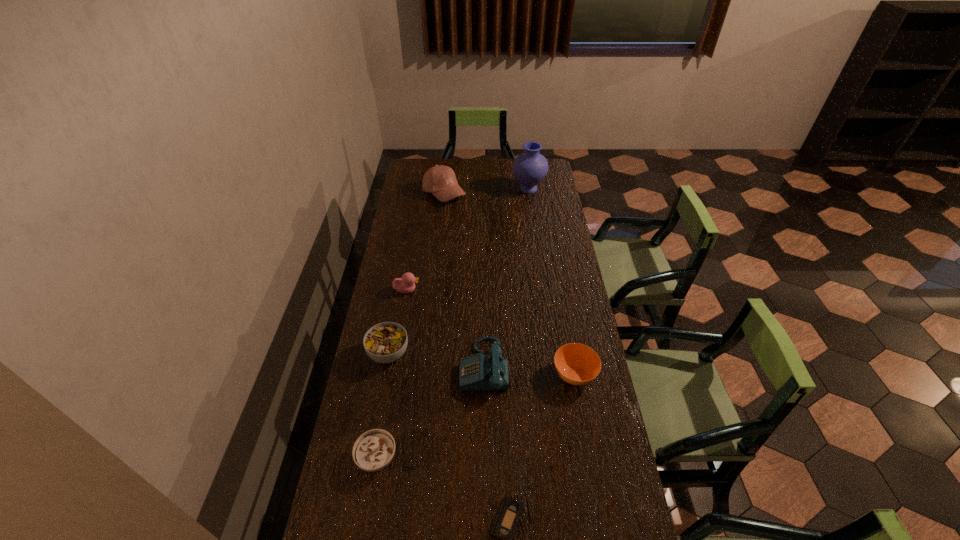
This screenshot has height=540, width=960. Find the location of `soup bowl that is at the right edge`. soup bowl that is at the right edge is located at coordinates (577, 364).

You are a GUI agent. You are given a task and a screenshot of the screen. Output one action in this format:
    pyautogui.click(x=<x>, y=<y>)
    Task: Click on the object situated at the far left corner
    The width and height of the screenshot is (960, 540).
    Given the screenshot: What is the action you would take?
    pyautogui.click(x=440, y=180)

The image size is (960, 540). I want to click on object situated at the far right corner, so click(530, 168).

In the image, there is a desktop. At what (x,y) coordinates should I click in order to perform the action: click on vacant area at the far edge. Please return your answer as a coordinate pair (x, y). This screenshot has height=540, width=960. Looking at the image, I should click on (469, 172).

In the image, there is a desktop. Identify the location of vacant space at the left edge. pos(426,224).

The width and height of the screenshot is (960, 540). In the image, there is a desktop. In order to click on vacant region at the right edge in this screenshot , I will do `click(563, 387)`.

The width and height of the screenshot is (960, 540). In the image, there is a desktop. What are the coordinates of `blank space at the far left corner` in the screenshot? It's located at (412, 170).

Locate an element on the screen. This screenshot has width=960, height=540. free space between the second tallest object and the second shortest object is located at coordinates (411, 326).

Where is `vacant space that's between the shortest soup bowl and the telephone`? The image size is (960, 540). vacant space that's between the shortest soup bowl and the telephone is located at coordinates (430, 412).

Where is `blank region between the telephone and the sixth nearest object`? blank region between the telephone and the sixth nearest object is located at coordinates (445, 328).